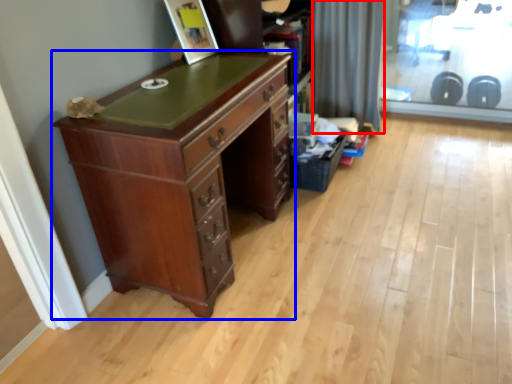
Question: Which object is closer to the camera taking this photo, curtain (highlighted by a red box) or chest of drawers (highlighted by a blue box)?

Choices:
 (A) curtain
 (B) chest of drawers

Answer: (B)